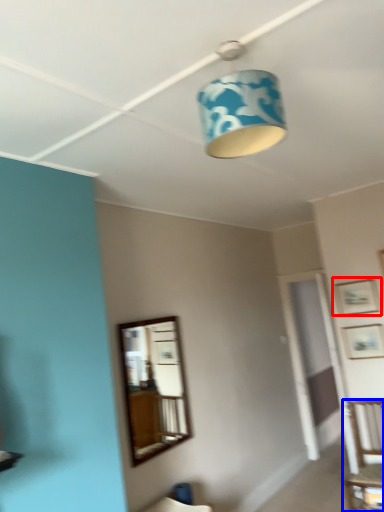
Question: Which object is further to the camera taking this photo, picture frame (highlighted by a red box) or furniture (highlighted by a blue box)?

Choices:
 (A) picture frame
 (B) furniture

Answer: (A)